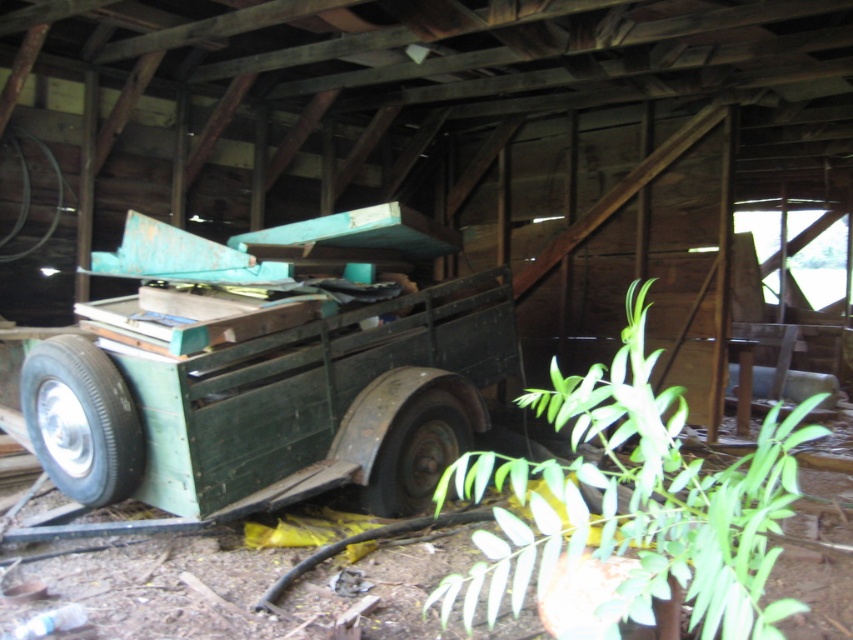
You are a delivery person trying to park your truck next to the green matte trailer at center. The truck requires a space wider than the dark green rubber tire at center. Is there enough space between the trailer and the barn wall to accommodate the truck?

The green matte trailer at center is wider than the dark green rubber tire at center. Since the truck needs a space wider than the tire, the space between the trailer and the barn wall is sufficient as it is wider than the tire.

You are standing inside the barn and want to pick up the black rubber tire at lower left and the dark green rubber tire at center. Which tire should you reach for first to grab the closest one?

The black rubber tire at lower left is closer to the viewer than the dark green rubber tire at center, so you should reach for the black rubber tire at lower left first.